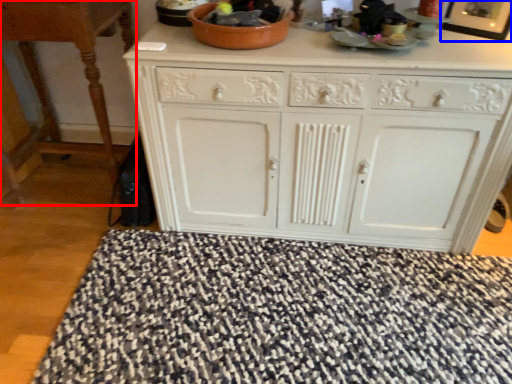
Question: Among these objects, which one is farthest to the camera, table (highlighted by a red box) or picture frame (highlighted by a blue box)?

Choices:
 (A) table
 (B) picture frame

Answer: (A)